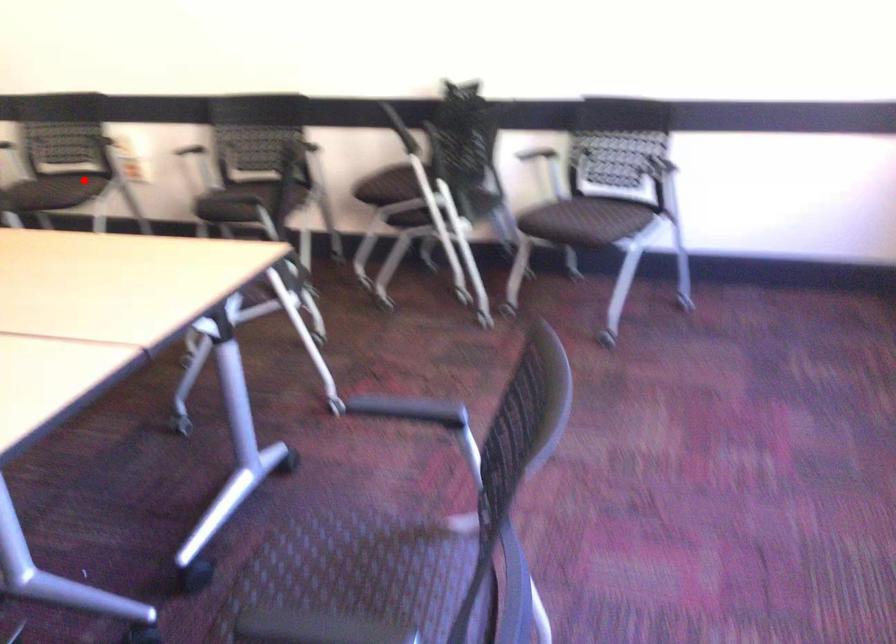
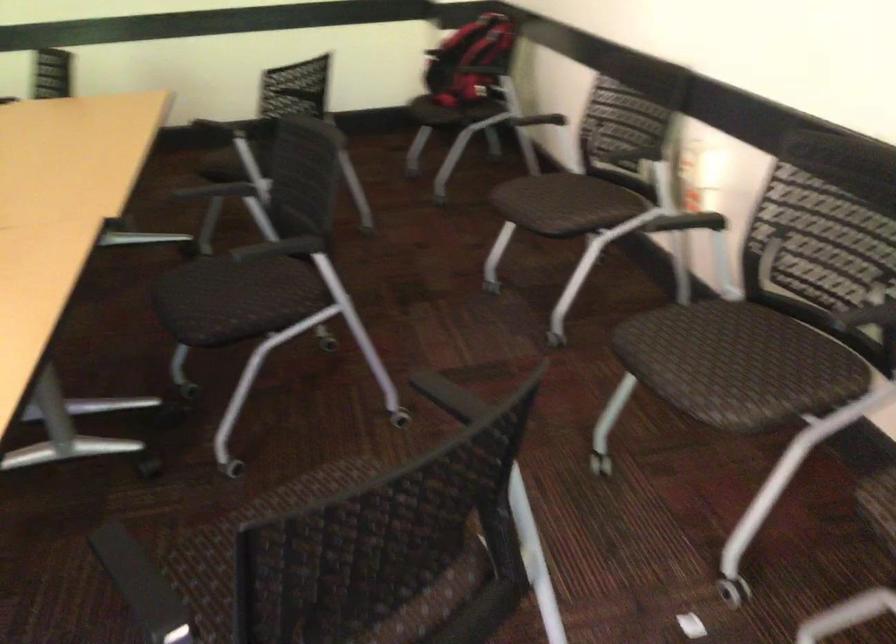
Question: I am providing you with two images of the same scene from different viewpoints. A red point is shown in image1. For the corresponding object point in image2, is it positioned nearer or farther from the camera?

Choices:
 (A) Nearer
 (B) Farther

Answer: (A)